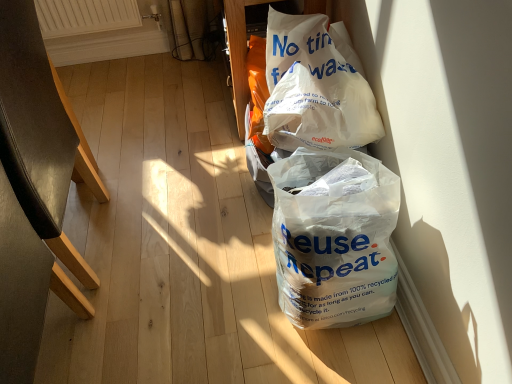
Question: Can you confirm if white paper bag at upper right, the 1th plastic bag in the top-to-bottom sequence, is shorter than black leather chair at left?

Choices:
 (A) yes
 (B) no

Answer: (A)

Question: Is black leather chair at left surrounded by white paper bag at upper right, the 1th plastic bag in the top-to-bottom sequence?

Choices:
 (A) yes
 (B) no

Answer: (B)

Question: From the image's perspective, does white paper bag at upper right, acting as the second plastic bag starting from the bottom, appear lower than black leather chair at left?

Choices:
 (A) yes
 (B) no

Answer: (B)

Question: Is white paper bag at upper right, the 1th plastic bag in the top-to-bottom sequence, turned away from black leather chair at left?

Choices:
 (A) yes
 (B) no

Answer: (B)

Question: Considering the relative sizes of white paper bag at upper right, acting as the second plastic bag starting from the bottom, and black leather chair at left in the image provided, is white paper bag at upper right, acting as the second plastic bag starting from the bottom, wider than black leather chair at left?

Choices:
 (A) no
 (B) yes

Answer: (A)

Question: Looking at their shapes, would you say black leather chair at left is wider or thinner than white paper bag at upper right, the 1th plastic bag in the top-to-bottom sequence?

Choices:
 (A) thin
 (B) wide

Answer: (B)

Question: In the image, is black leather chair at left positioned in front of or behind white paper bag at upper right, acting as the second plastic bag starting from the bottom?

Choices:
 (A) front
 (B) behind

Answer: (A)

Question: Does point (32, 38) appear closer or farther from the camera than point (298, 134)?

Choices:
 (A) farther
 (B) closer

Answer: (A)

Question: Is black leather chair at left spatially inside white paper bag at upper right, the 1th plastic bag in the top-to-bottom sequence, or outside of it?

Choices:
 (A) inside
 (B) outside

Answer: (B)

Question: In terms of width, does black leather chair at left look wider or thinner when compared to white textured radiator at upper left?

Choices:
 (A) thin
 (B) wide

Answer: (B)

Question: Does point (37, 201) appear closer or farther from the camera than point (87, 31)?

Choices:
 (A) closer
 (B) farther

Answer: (A)

Question: Is black leather chair at left taller or shorter than white textured radiator at upper left?

Choices:
 (A) tall
 (B) short

Answer: (A)

Question: Considering the positions of black leather chair at left and white textured radiator at upper left in the image, is black leather chair at left bigger or smaller than white textured radiator at upper left?

Choices:
 (A) big
 (B) small

Answer: (A)

Question: Visually, is white plastic bag at lower right, the second plastic bag in the top-to-bottom sequence, positioned to the left or to the right of white textured radiator at upper left?

Choices:
 (A) left
 (B) right

Answer: (B)

Question: Is white plastic bag at lower right, the second plastic bag in the top-to-bottom sequence, inside or outside of white textured radiator at upper left?

Choices:
 (A) outside
 (B) inside

Answer: (A)